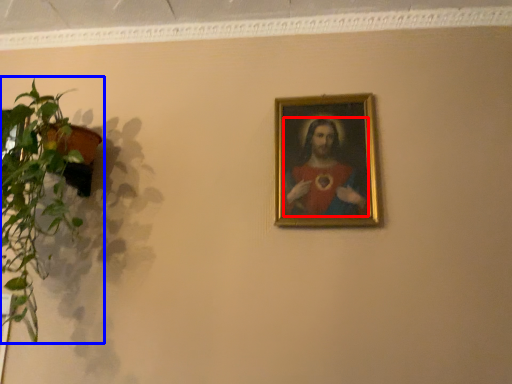
Question: Which point is further to the camera, person (highlighted by a red box) or houseplant (highlighted by a blue box)?

Choices:
 (A) person
 (B) houseplant

Answer: (A)